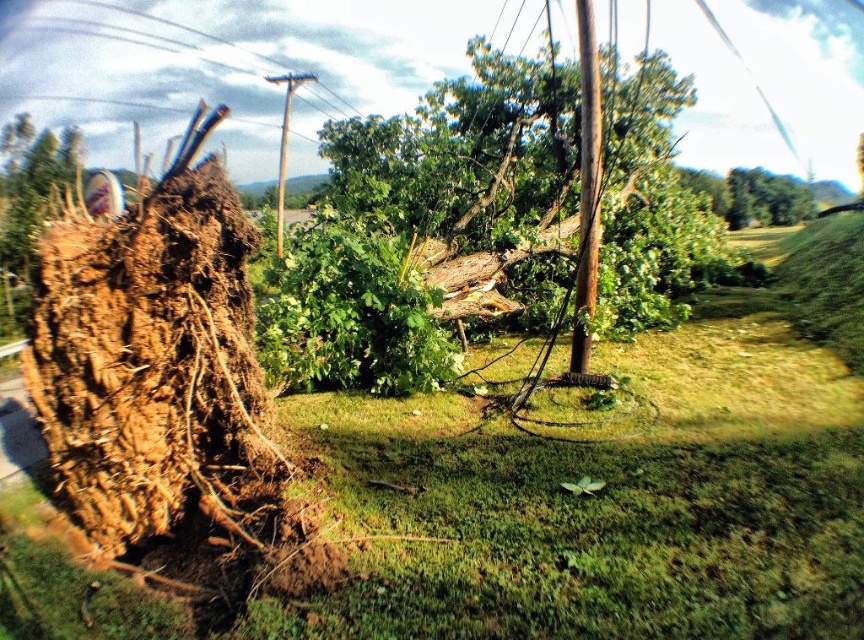
Does green grass at center appear over green leafy tree at center?

Incorrect, green grass at center is not positioned above green leafy tree at center.

Does point (468, 486) come behind point (599, 189)?

No, it is not.

At what (x,y) coordinates should I click in order to perform the action: click on green grass at center. Please return your answer as a coordinate pair (x, y). Image resolution: width=864 pixels, height=640 pixels. Looking at the image, I should click on (619, 484).

Which is behind, point (526, 552) or point (300, 77)?

The point (300, 77) is more distant.

Can you confirm if green grass at center is positioned to the right of brown wooden telegraph pole at upper center?

Correct, you'll find green grass at center to the right of brown wooden telegraph pole at upper center.

Which is in front, point (617, 506) or point (290, 80)?

Point (617, 506) is more forward.

The image size is (864, 640). What are the coordinates of `green grass at center` in the screenshot? It's located at (619, 484).

Is brown wooden pole at center thinner than brown wooden telegraph pole at upper center?

Indeed, brown wooden pole at center has a lesser width compared to brown wooden telegraph pole at upper center.

Is brown wooden pole at center behind brown wooden telegraph pole at upper center?

No, it is not.

Locate an element on the screen. brown wooden pole at center is located at coordinates (586, 184).